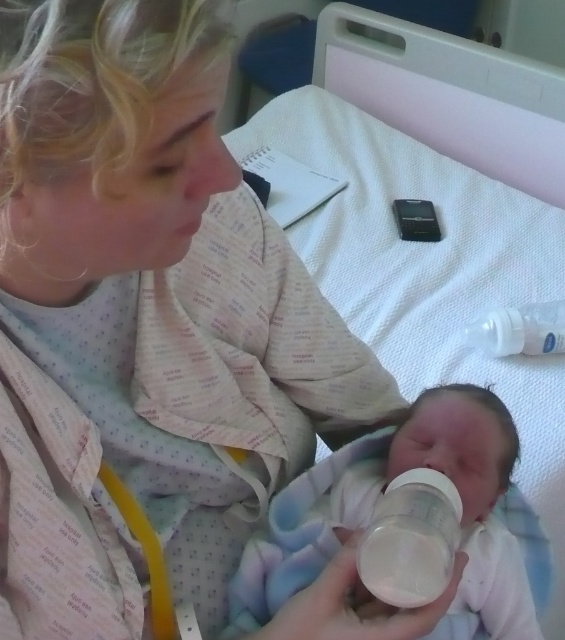
Which is behind, point (458, 531) or point (527, 339)?

The point (527, 339) is behind.

How much distance is there between white matte baby bottle at center and transparent plastic bottle at upper right?

white matte baby bottle at center and transparent plastic bottle at upper right are 66.30 centimeters apart.

Identify the location of white matte baby bottle at center. (411, 540).

This screenshot has height=640, width=565. Find the location of `white matte baby bottle at center`. white matte baby bottle at center is located at coordinates (411, 540).

Is transparent plastic bottle at center to the right of transparent plastic bottle at upper right from the viewer's perspective?

No, transparent plastic bottle at center is not to the right of transparent plastic bottle at upper right.

Does transparent plastic bottle at center appear under transparent plastic bottle at upper right?

Correct, transparent plastic bottle at center is located below transparent plastic bottle at upper right.

Image resolution: width=565 pixels, height=640 pixels. What are the coordinates of `transparent plastic bottle at center` in the screenshot? It's located at (380, 497).

Does transparent plastic bottle at center appear under white matte baby bottle at center?

Yes.

Does transparent plastic bottle at center have a greater width compared to white matte baby bottle at center?

Indeed, transparent plastic bottle at center has a greater width compared to white matte baby bottle at center.

Between point (385, 442) and point (420, 588), which one is positioned in front?

Point (420, 588) is in front.

Where is `transparent plastic bottle at center`? The height and width of the screenshot is (640, 565). transparent plastic bottle at center is located at coordinates (380, 497).